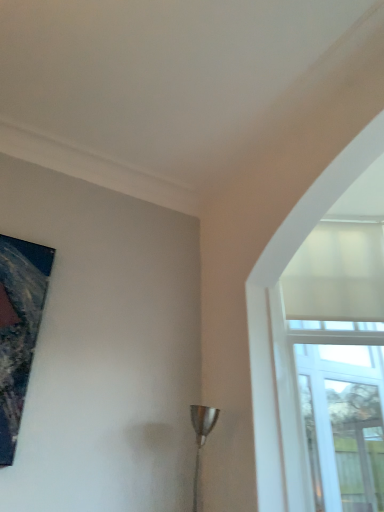
Question: Is point click(201, 434) positioned closer to the camera than point click(266, 357)?

Choices:
 (A) closer
 (B) farther

Answer: (A)

Question: Relative to white matte glass window at upper right, is metallic silver lamp at lower center in front or behind?

Choices:
 (A) behind
 (B) front

Answer: (B)

Question: Which object is positioned closest to the metallic silver lamp at lower center?

Choices:
 (A) white matte glass window at upper right
 (B) metallic painting at upper left

Answer: (A)

Question: Which is nearer to the white matte glass window at upper right?

Choices:
 (A) metallic silver lamp at lower center
 (B) metallic painting at upper left

Answer: (A)